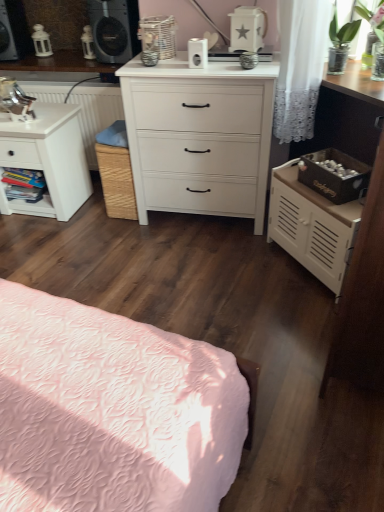
The image size is (384, 512). I want to click on free region on the left part of white matte cabinet at right, placed as the second nightstand when sorted from left to right, so click(241, 268).